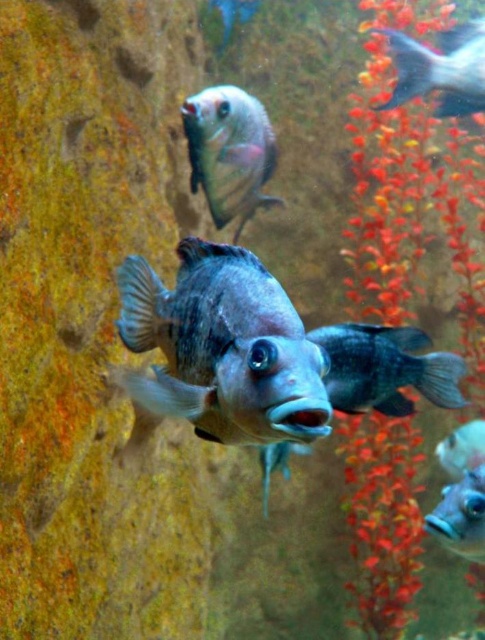
Between point (186, 113) and point (436, 72), which one is positioned behind?

The point (436, 72) is more distant.

Does satin silver fish at upper center come behind shiny silver fish at upper right?

No.

Image resolution: width=485 pixels, height=640 pixels. Describe the element at coordinates (229, 152) in the screenshot. I see `satin silver fish at upper center` at that location.

Locate an element on the screen. The height and width of the screenshot is (640, 485). satin silver fish at upper center is located at coordinates (229, 152).

In the scene shown: Is shiny blue fish at center taller than shiny silver fish at upper right?

Incorrect, shiny blue fish at center's height is not larger of shiny silver fish at upper right's.

Is shiny blue fish at center smaller than shiny silver fish at upper right?

Actually, shiny blue fish at center might be larger than shiny silver fish at upper right.

Which is in front, point (300, 422) or point (472, 26)?

Positioned in front is point (300, 422).

You are a GUI agent. You are given a task and a screenshot of the screen. Output one action in this format:
    pyautogui.click(x=<x>, y=<y>)
    Task: Click on the shiny blue fish at center
    The height and width of the screenshot is (640, 485).
    Given the screenshot: What is the action you would take?
    pyautogui.click(x=223, y=348)

Does point (462, 529) come closer to viewer compared to point (443, 467)?

Yes, point (462, 529) is in front of point (443, 467).

Is shiny blue fish at lower right below satin silver fish at lower right?

No.

Between point (478, 513) and point (463, 472), which one is positioned in front?

Point (478, 513) is in front.

At what (x,y) coordinates should I click in order to perform the action: click on shiny blue fish at lower right. Please return your answer as a coordinate pair (x, y). Looking at the image, I should click on (461, 515).